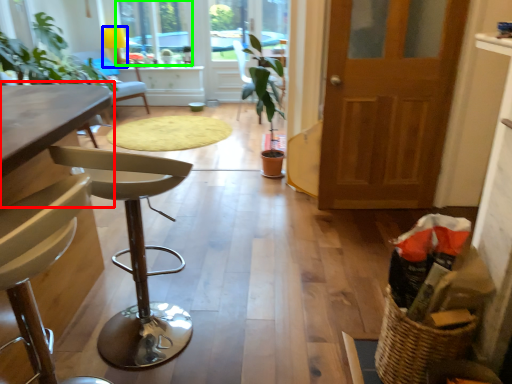
Question: Estimate the real-world distances between objects in this image. Which object is closer to table (highlighted by a red box), lamp (highlighted by a blue box) or window (highlighted by a green box)?

Choices:
 (A) lamp
 (B) window

Answer: (B)